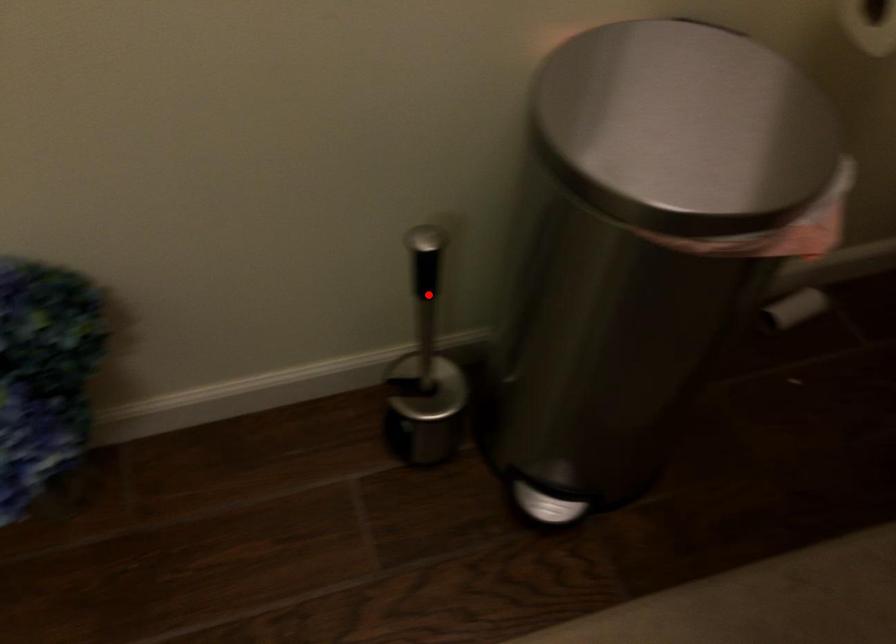
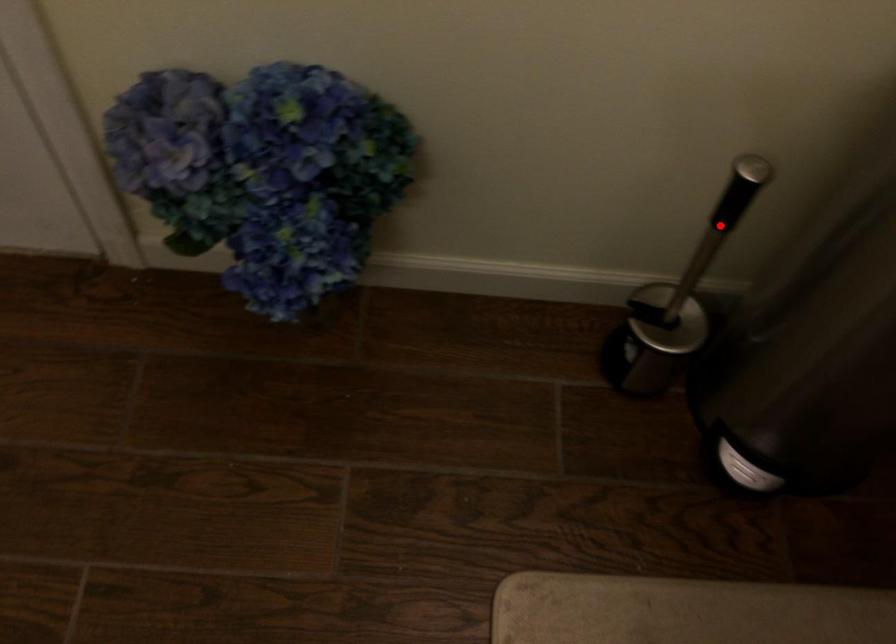
I am providing you with two images of the same scene from different viewpoints. A red point is marked on the first image and another point is marked on the second image. Does the point marked in image1 correspond to the same location as the one in image2?

Yes